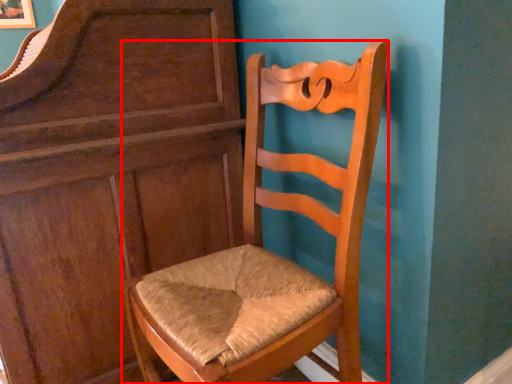
Question: Where is chair (annotated by the red box) located in relation to dresser in the image?

Choices:
 (A) left
 (B) right

Answer: (B)